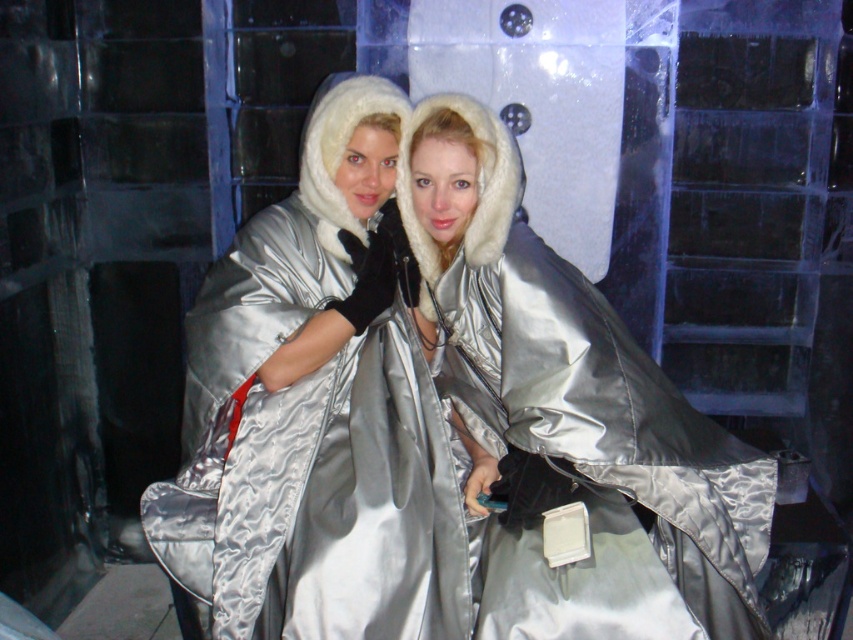
Question: Does satin silver coat at center appear on the left side of satin silver cape at center?

Choices:
 (A) no
 (B) yes

Answer: (B)

Question: Which point appears farthest from the camera in this image?

Choices:
 (A) (495, 376)
 (B) (250, 339)

Answer: (A)

Question: Which object appears closest to the camera in this image?

Choices:
 (A) satin silver cape at center
 (B) satin silver coat at center

Answer: (B)

Question: Does satin silver coat at center have a smaller size compared to satin silver cape at center?

Choices:
 (A) no
 (B) yes

Answer: (A)

Question: Is satin silver coat at center positioned at the back of satin silver cape at center?

Choices:
 (A) yes
 (B) no

Answer: (B)